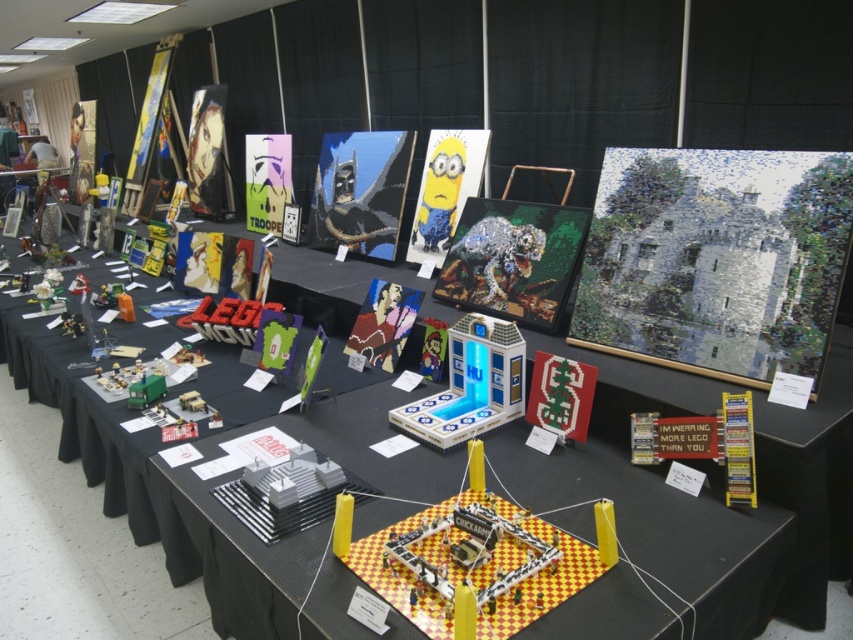
Does yellow plastic lego structure at center lie in front of matte green car at center?

Yes, it is in front of matte green car at center.

Does yellow plastic lego structure at center have a lesser height compared to matte green car at center?

In fact, yellow plastic lego structure at center may be taller than matte green car at center.

Identify the location of yellow plastic lego structure at center. This screenshot has height=640, width=853. (479, 563).

Does brick-like lego structure at center have a larger size compared to green plastic toy at center?

Correct, brick-like lego structure at center is larger in size than green plastic toy at center.

Between brick-like lego structure at center and green plastic toy at center, which one appears on the left side from the viewer's perspective?

brick-like lego structure at center is more to the left.

The image size is (853, 640). What do you see at coordinates (811, 481) in the screenshot?
I see `brick-like lego structure at center` at bounding box center [811, 481].

You are a GUI agent. You are given a task and a screenshot of the screen. Output one action in this format:
    pyautogui.click(x=<x>, y=<y>)
    Task: Click on the brick-like lego structure at center
    The width and height of the screenshot is (853, 640).
    Given the screenshot: What is the action you would take?
    811,481

Is point (302, 417) closer to camera compared to point (457, 198)?

Yes, it is in front of point (457, 198).

You are a GUI agent. You are given a task and a screenshot of the screen. Output one action in this format:
    pyautogui.click(x=<x>, y=<y>)
    Task: Click on the brick-like lego structure at center
    The width and height of the screenshot is (853, 640).
    Given the screenshot: What is the action you would take?
    pos(811,481)